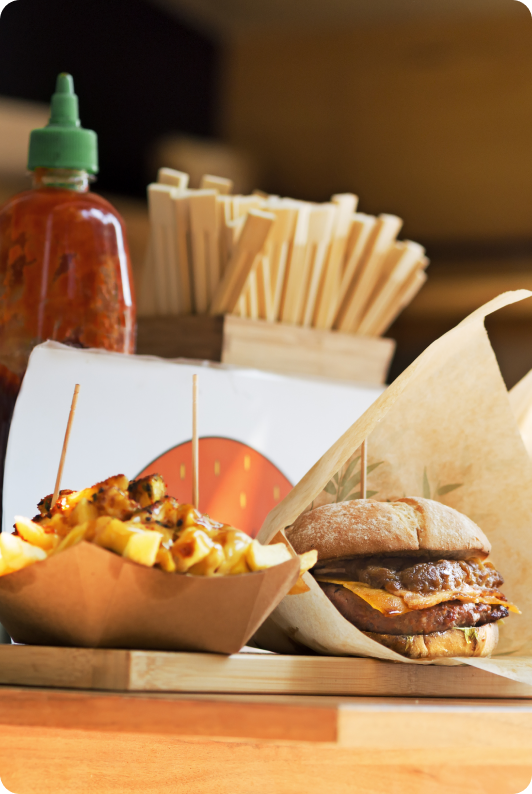
Find the location of `edge of tray`. edge of tray is located at coordinates (128, 680), (128, 664).